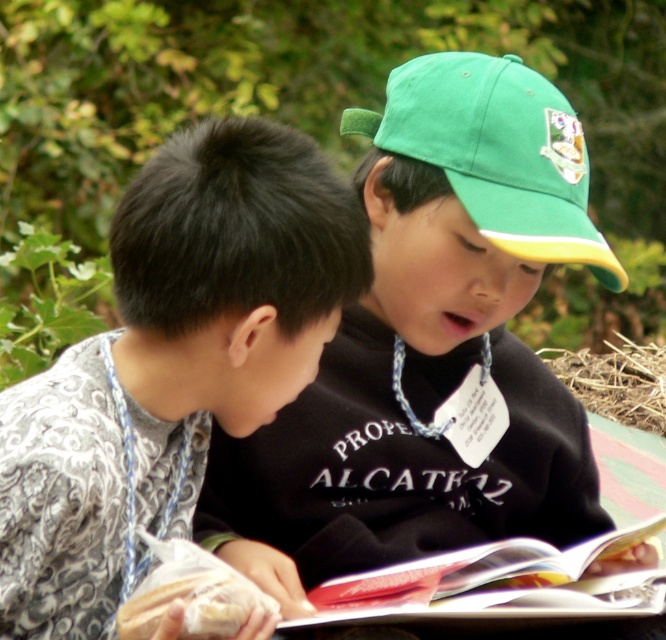
Question: Can you confirm if green fabric baseball cap at upper right is positioned to the left of paperback book at center?

Choices:
 (A) yes
 (B) no

Answer: (B)

Question: Which point is closer to the camera?

Choices:
 (A) green fabric baseball cap at upper right
 (B) brown straw at lower right
 (C) green fabric cap at upper right
 (D) gray patterned shirt at left

Answer: (D)

Question: Among these objects, which one is farthest from the camera?

Choices:
 (A) gray patterned shirt at left
 (B) brown straw at lower right
 (C) green fabric baseball cap at upper right
 (D) paperback book at center

Answer: (B)

Question: Does green fabric cap at upper right have a smaller size compared to brown straw at lower right?

Choices:
 (A) no
 (B) yes

Answer: (A)

Question: Which point is closer to the camera?

Choices:
 (A) paperback book at center
 (B) gray patterned shirt at left
 (C) green fabric baseball cap at upper right

Answer: (B)

Question: From the image, what is the correct spatial relationship of green fabric cap at upper right in relation to paperback book at center?

Choices:
 (A) above
 (B) below

Answer: (A)